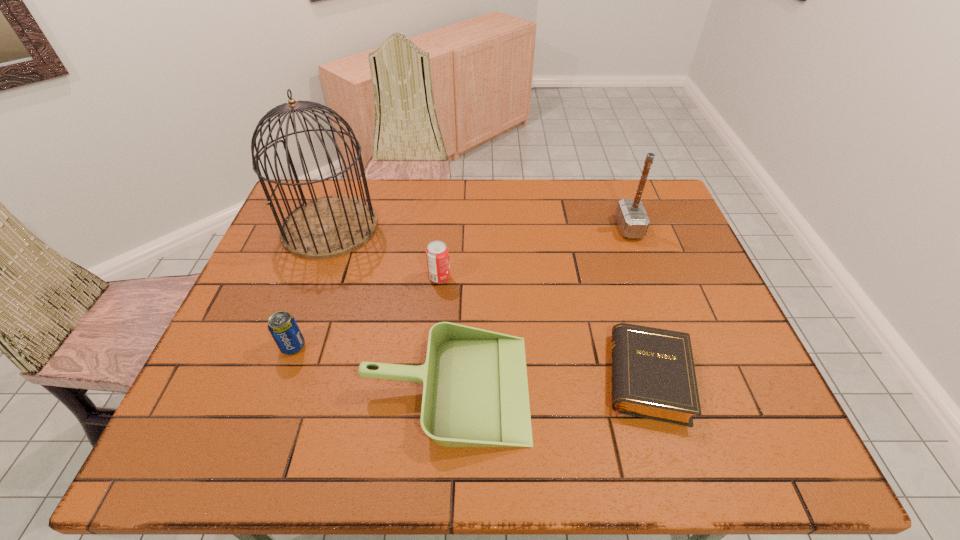
Where is `free spot located on the striking surface of the fifth shortest object`? This screenshot has height=540, width=960. free spot located on the striking surface of the fifth shortest object is located at coordinates (499, 228).

Locate an element on the screen. free space located on the front of the farther soda is located at coordinates (437, 314).

Where is `free location located on the right of the nearer soda`? This screenshot has width=960, height=540. free location located on the right of the nearer soda is located at coordinates (383, 346).

Image resolution: width=960 pixels, height=540 pixels. Identify the location of vacant area located on the scoop of the dustpan. (657, 387).

At what (x,y) coordinates should I click in order to perform the action: click on vacant space located 0.110m on the back of the shortest object. Please return your answer as a coordinate pair (x, y). The width and height of the screenshot is (960, 540). Looking at the image, I should click on (625, 300).

Find the location of a particular element. The image size is (960, 540). birdcage at the far edge is located at coordinates (331, 226).

You are a GUI agent. You are given a task and a screenshot of the screen. Output one action in this format:
    pyautogui.click(x=<x>, y=<y>)
    Task: Click on the hammer positioned at the far edge
    Image resolution: width=960 pixels, height=540 pixels.
    Given the screenshot: What is the action you would take?
    pyautogui.click(x=632, y=219)

The width and height of the screenshot is (960, 540). I want to click on dustpan present at the near edge, so click(475, 390).

Where is `Bible present at the near edge`? Bible present at the near edge is located at coordinates (653, 376).

Locate an element on the screen. birdcage located at the left edge is located at coordinates (331, 226).